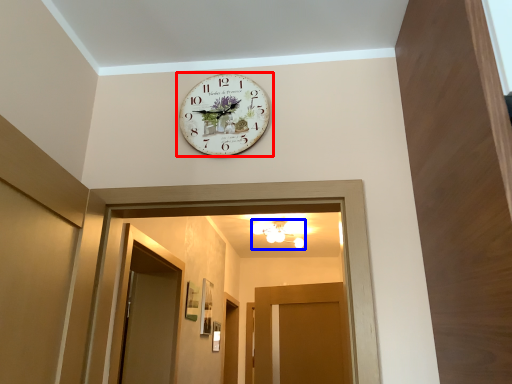
Question: Which of the following is the farthest to the observer, wall clock (highlighted by a red box) or light fixture (highlighted by a blue box)?

Choices:
 (A) wall clock
 (B) light fixture

Answer: (B)